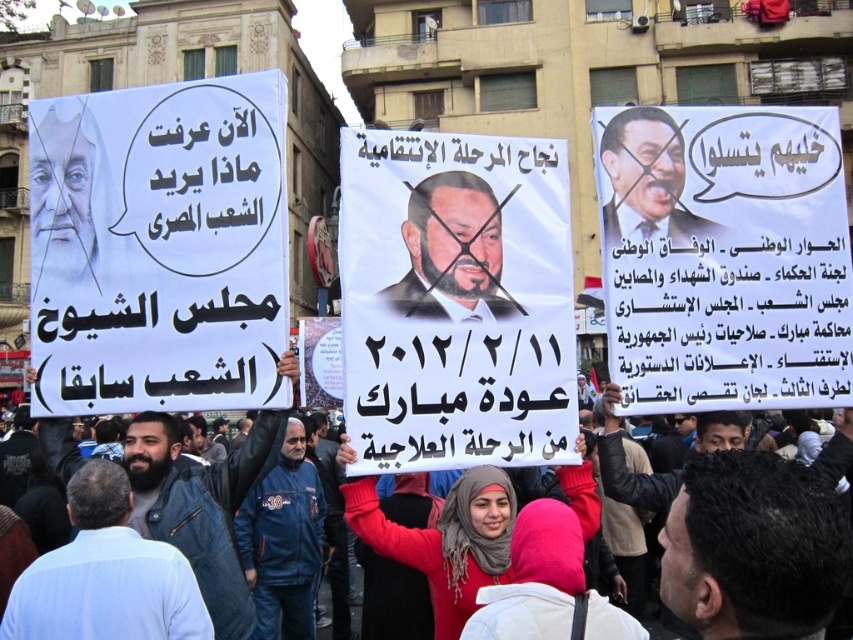
Which is behind, point (395, 262) or point (323, 532)?

The point (323, 532) is behind.

Who is higher up, matte paper poster at center or blue fabric jacket at center?

matte paper poster at center

Image resolution: width=853 pixels, height=640 pixels. What do you see at coordinates (456, 300) in the screenshot? I see `matte paper poster at center` at bounding box center [456, 300].

Where is `matte paper poster at center`? The width and height of the screenshot is (853, 640). matte paper poster at center is located at coordinates (456, 300).

Between dark brown hair at center and white paper sign at center, which one appears on the right side from the viewer's perspective?

From the viewer's perspective, dark brown hair at center appears more on the right side.

The width and height of the screenshot is (853, 640). Identify the location of dark brown hair at center. pyautogui.click(x=753, y=547).

Which is more to the right, dark brown paper at center or matte black poster at upper right?

Positioned to the right is matte black poster at upper right.

Which is below, dark brown paper at center or matte black poster at upper right?

dark brown paper at center

Which is behind, point (440, 173) or point (671, 160)?

Positioned behind is point (671, 160).

Find the location of `dark brown paper at center`. dark brown paper at center is located at coordinates (451, 250).